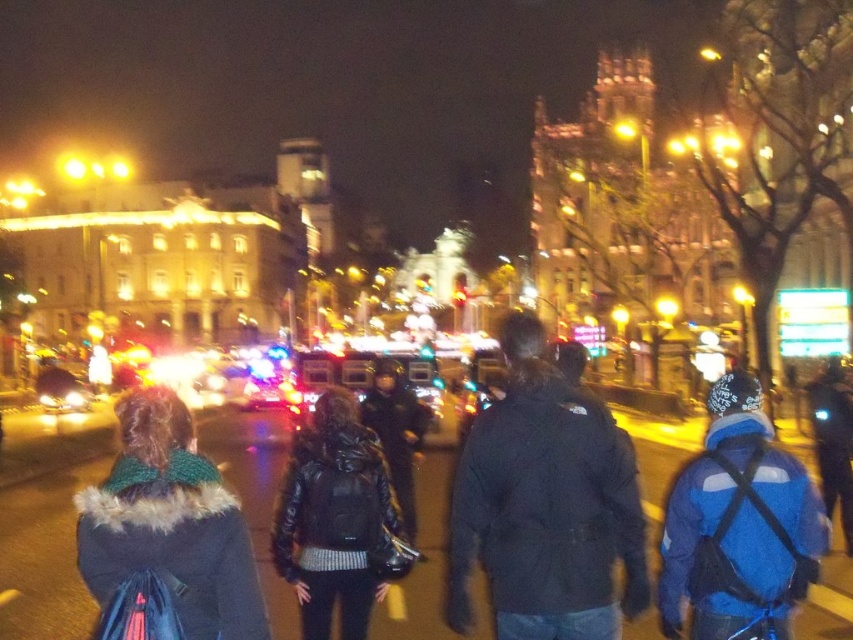
Is point (537, 368) closer to camera compared to point (375, 540)?

No, (537, 368) is further to viewer.

The height and width of the screenshot is (640, 853). What do you see at coordinates (544, 506) in the screenshot? I see `black matte jacket at center` at bounding box center [544, 506].

At what (x,y) coordinates should I click in order to perform the action: click on black matte jacket at center. Please return your answer as a coordinate pair (x, y). Image resolution: width=853 pixels, height=640 pixels. Looking at the image, I should click on (544, 506).

Locate an element on the screen. The height and width of the screenshot is (640, 853). black matte jacket at center is located at coordinates (544, 506).

Is black matte jacket at center shorter than blue matte jacket at lower right?

Incorrect, black matte jacket at center's height does not fall short of blue matte jacket at lower right's.

You are a GUI agent. You are given a task and a screenshot of the screen. Output one action in this format:
    pyautogui.click(x=<x>, y=<y>)
    Task: Click on the black matte jacket at center
    Image resolution: width=853 pixels, height=640 pixels.
    Given the screenshot: What is the action you would take?
    pyautogui.click(x=544, y=506)

Measure the distance between point (746, 380) and camera.

Point (746, 380) and camera are 288.07 feet apart from each other.

Who is more forward, (x=758, y=476) or (x=169, y=544)?

Positioned in front is point (x=169, y=544).

Is point (675, 563) behind point (154, 525)?

Yes, point (675, 563) is farther from viewer.

This screenshot has height=640, width=853. In order to click on blue matte jacket at lower right in this screenshot , I will do `click(738, 525)`.